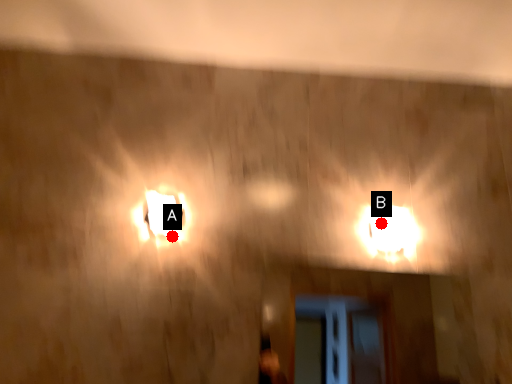
Question: Two points are circled on the image, labeled by A and B beside each circle. Which point is closer to the camera taking this photo?

Choices:
 (A) A is closer
 (B) B is closer

Answer: (A)